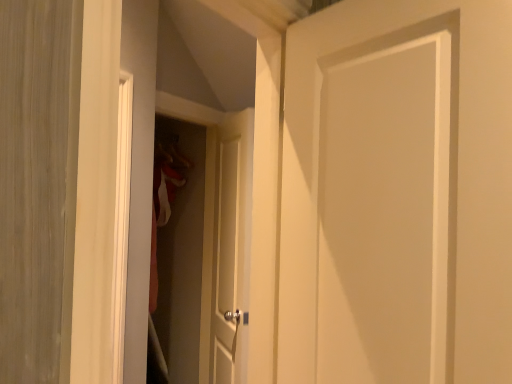
The image size is (512, 384). What do you see at coordinates (182, 254) in the screenshot?
I see `matte white screen door at center` at bounding box center [182, 254].

Measure the distance between point (x=245, y=138) and camera.

Point (x=245, y=138) is 6.56 feet from camera.

Find the location of a particular element. The image size is (512, 384). matte white screen door at center is located at coordinates (182, 254).

Which object is positioned more to the left, white matte door at center, the second door positioned from the right, or white matte door at center, the 1th door when ordered from front to back?

white matte door at center, the second door positioned from the right, is more to the left.

Who is smaller, white matte door at center, the 1th door in the back-to-front sequence, or white matte door at center, placed as the second door when sorted from back to front?

white matte door at center, placed as the second door when sorted from back to front, is smaller.

Considering the positions of point (234, 173) and point (510, 273), is point (234, 173) closer or farther from the camera than point (510, 273)?

Point (234, 173) is positioned farther from the camera compared to point (510, 273).

Considering the sizes of objects white matte door at center, the 1th door in the left-to-right sequence, and white matte door at center, the 1th door when ordered from front to back, in the image provided, who is wider, white matte door at center, the 1th door in the left-to-right sequence, or white matte door at center, the 1th door when ordered from front to back,?

white matte door at center, the 1th door when ordered from front to back.

Locate an element on the screen. The width and height of the screenshot is (512, 384). screen door to the left of white matte door at center, the 1th door when ordered from front to back is located at coordinates (182, 254).

Is white matte door at center, arranged as the second door when viewed from the left, to the right of matte white screen door at center from the viewer's perspective?

Indeed, white matte door at center, arranged as the second door when viewed from the left, is positioned on the right side of matte white screen door at center.

Is white matte door at center, the 1th door when ordered from front to back, closer to camera compared to matte white screen door at center?

Yes, the depth of white matte door at center, the 1th door when ordered from front to back, is less than that of matte white screen door at center.

Looking at their sizes, would you say white matte door at center, acting as the 1th door starting from the right, is wider or thinner than matte white screen door at center?

Clearly, white matte door at center, acting as the 1th door starting from the right, has less width compared to matte white screen door at center.

Can you see white matte door at center, acting as the 1th door starting from the right, touching white matte door at center, the 2th door positioned from the front?

white matte door at center, acting as the 1th door starting from the right, and white matte door at center, the 2th door positioned from the front, are clearly separated.

Considering the relative positions of white matte door at center, arranged as the second door when viewed from the left, and white matte door at center, the 2th door positioned from the front, in the image provided, is white matte door at center, arranged as the second door when viewed from the left, to the left or to the right of white matte door at center, the 2th door positioned from the front,?

From the image, it's evident that white matte door at center, arranged as the second door when viewed from the left, is to the right of white matte door at center, the 2th door positioned from the front.

Considering the sizes of white matte door at center, acting as the 1th door starting from the right, and white matte door at center, the second door positioned from the right, in the image, is white matte door at center, acting as the 1th door starting from the right, taller or shorter than white matte door at center, the second door positioned from the right,?

Considering their sizes, white matte door at center, acting as the 1th door starting from the right, has less height than white matte door at center, the second door positioned from the right.

Which object is wider, white matte door at center, placed as the second door when sorted from back to front, or white matte door at center, the second door positioned from the right?

Wider between the two is white matte door at center, placed as the second door when sorted from back to front.

Considering the positions of objects matte white screen door at center and white matte door at center, placed as the second door when sorted from back to front, in the image provided, who is more to the right, matte white screen door at center or white matte door at center, placed as the second door when sorted from back to front,?

white matte door at center, placed as the second door when sorted from back to front.

This screenshot has width=512, height=384. Identify the location of screen door behind the white matte door at center, placed as the second door when sorted from back to front. (182, 254).

How different are the orientations of matte white screen door at center and white matte door at center, acting as the 1th door starting from the right, in degrees?

101 degrees separate the facing orientations of matte white screen door at center and white matte door at center, acting as the 1th door starting from the right.

From the image's perspective, is matte white screen door at center on top of white matte door at center, acting as the 1th door starting from the right?

No.

Consider the image. From a real-world perspective, is white matte door at center, the 1th door in the left-to-right sequence, positioned above or below matte white screen door at center?

Clearly, from a real-world perspective, white matte door at center, the 1th door in the left-to-right sequence, is below matte white screen door at center.

Is white matte door at center, the 2th door positioned from the front, taller than matte white screen door at center?

No.

In order to click on the 1st door in front of the matte white screen door at center in this screenshot , I will do `click(231, 245)`.

Are matte white screen door at center and white matte door at center, the 2th door positioned from the front, beside each other?

→ matte white screen door at center and white matte door at center, the 2th door positioned from the front, are clearly separated.

Which is in front, point (189, 287) or point (233, 294)?

Point (233, 294)

From the image's perspective, is matte white screen door at center above or below white matte door at center, the 2th door positioned from the front?

From the image's perspective, matte white screen door at center appears above white matte door at center, the 2th door positioned from the front.

From a real-world perspective, which is physically above, matte white screen door at center or white matte door at center, the 1th door in the left-to-right sequence?

From a 3D spatial view, matte white screen door at center is above.

I want to click on door below the white matte door at center, arranged as the second door when viewed from the left (from the image's perspective), so click(x=231, y=245).

From the matte white screen door at center, count 2nd door to the right and point to it. Please provide its 2D coordinates.

[(397, 194)]

Considering their positions, is white matte door at center, the 1th door when ordered from front to back, positioned further to white matte door at center, the 1th door in the back-to-front sequence, than matte white screen door at center?

white matte door at center, the 1th door when ordered from front to back, is further to white matte door at center, the 1th door in the back-to-front sequence.

From the image, which object appears to be nearer to white matte door at center, the 2th door positioned from the front, matte white screen door at center or white matte door at center, arranged as the second door when viewed from the left?

matte white screen door at center.

When comparing their distances from matte white screen door at center, does white matte door at center, acting as the 1th door starting from the right, or white matte door at center, the 1th door in the back-to-front sequence, seem further?

Among the two, white matte door at center, acting as the 1th door starting from the right, is located further to matte white screen door at center.

Estimate the real-world distances between objects in this image. Which object is closer to matte white screen door at center, white matte door at center, the 2th door positioned from the front, or white matte door at center, acting as the 1th door starting from the right?

white matte door at center, the 2th door positioned from the front, lies closer to matte white screen door at center than the other object.

Which object lies further to the anchor point white matte door at center, acting as the 1th door starting from the right, matte white screen door at center or white matte door at center, the 1th door in the back-to-front sequence?

matte white screen door at center is positioned further to the anchor white matte door at center, acting as the 1th door starting from the right.

Considering their positions, is white matte door at center, the 2th door positioned from the front, positioned closer to white matte door at center, the 1th door when ordered from front to back, than matte white screen door at center?

white matte door at center, the 2th door positioned from the front, is positioned closer to the anchor white matte door at center, the 1th door when ordered from front to back.

The image size is (512, 384). Identify the location of door between white matte door at center, arranged as the second door when viewed from the left, and matte white screen door at center from front to back. (231, 245).